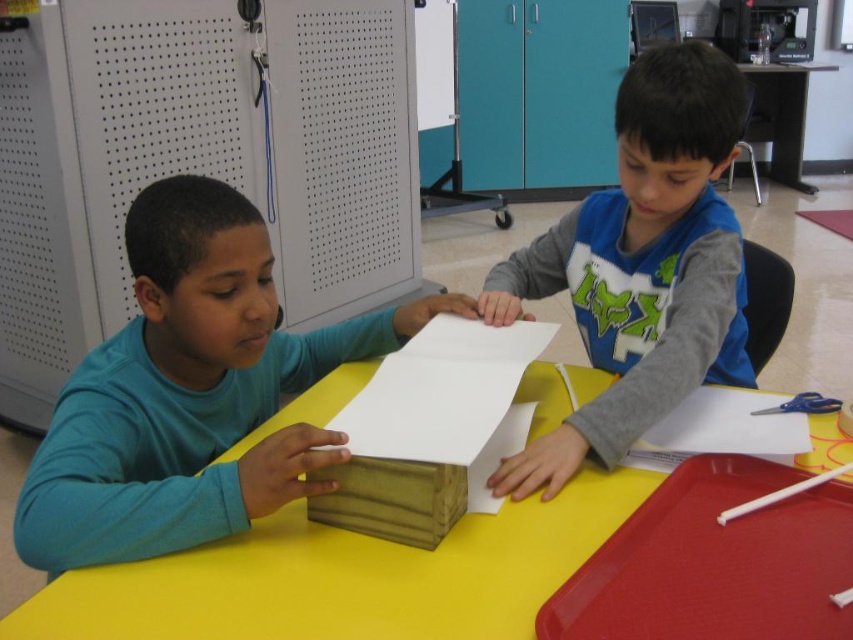
Question: Is matte wood block at left bigger than yellow matte table at center?

Choices:
 (A) no
 (B) yes

Answer: (B)

Question: Estimate the real-world distances between objects in this image. Which object is farther from the matte gray shirt at center?

Choices:
 (A) wooden block at center
 (B) matte wood block at left
 (C) yellow matte table at center
 (D) wooden table at upper right

Answer: (D)

Question: Can you confirm if wooden block at center is thinner than wooden table at upper right?

Choices:
 (A) yes
 (B) no

Answer: (A)

Question: Which point is farther to the camera?

Choices:
 (A) (184, 516)
 (B) (631, 90)

Answer: (B)

Question: Which point appears farthest from the camera in this image?

Choices:
 (A) (805, 72)
 (B) (560, 244)
 (C) (173, 252)
 (D) (496, 328)

Answer: (A)

Question: Is matte wood block at left bigger than matte gray shirt at center?

Choices:
 (A) no
 (B) yes

Answer: (A)